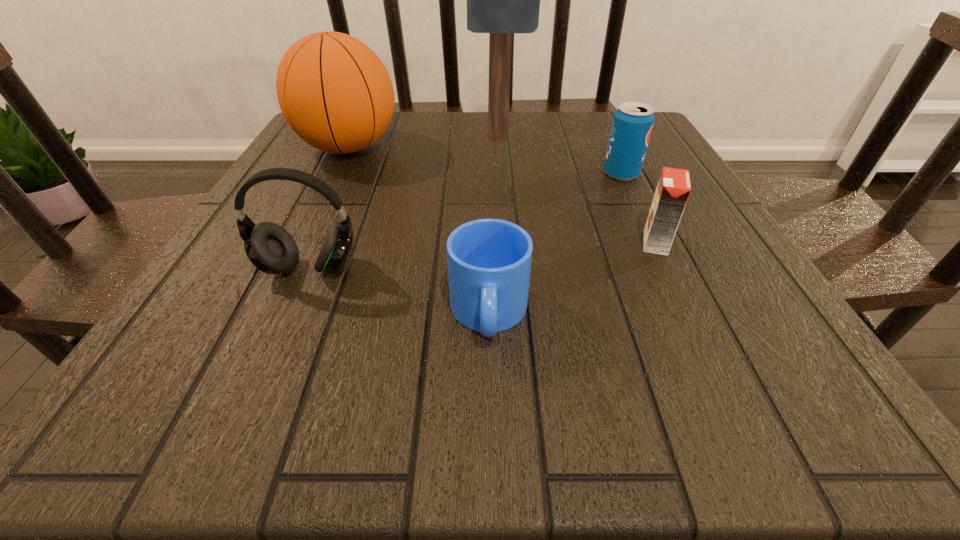
Where is `the tallest object`? The image size is (960, 540). the tallest object is located at coordinates (501, 0).

Identify the location of basketball. (334, 91).

At what (x,y) coordinates should I click in order to perform the action: click on headset. Please return your answer as a coordinate pair (x, y). Looking at the image, I should click on (270, 248).

This screenshot has height=540, width=960. What are the coordinates of `soda can` in the screenshot? It's located at (632, 125).

Where is `orange juice`? Image resolution: width=960 pixels, height=540 pixels. orange juice is located at coordinates (673, 189).

At what (x,y) coordinates should I click in order to perform the action: click on mug. Please return your answer as a coordinate pair (x, y). Looking at the image, I should click on (489, 260).

Identify the location of vacant space located 0.200m on the front of the mallet. Image resolution: width=960 pixels, height=540 pixels. (502, 211).

Find the location of a particular element. free space located 0.080m on the right of the second tallest object is located at coordinates (434, 147).

You are a GUI agent. You are given a task and a screenshot of the screen. Output one action in this format:
    pyautogui.click(x=<x>, y=<y>)
    Task: Click on the free region located on the ear cups of the headset
    Image resolution: width=960 pixels, height=540 pixels.
    Given the screenshot: What is the action you would take?
    pyautogui.click(x=249, y=407)

What are the coordinates of `vacant region located on the left of the soda can` in the screenshot? It's located at (523, 174).